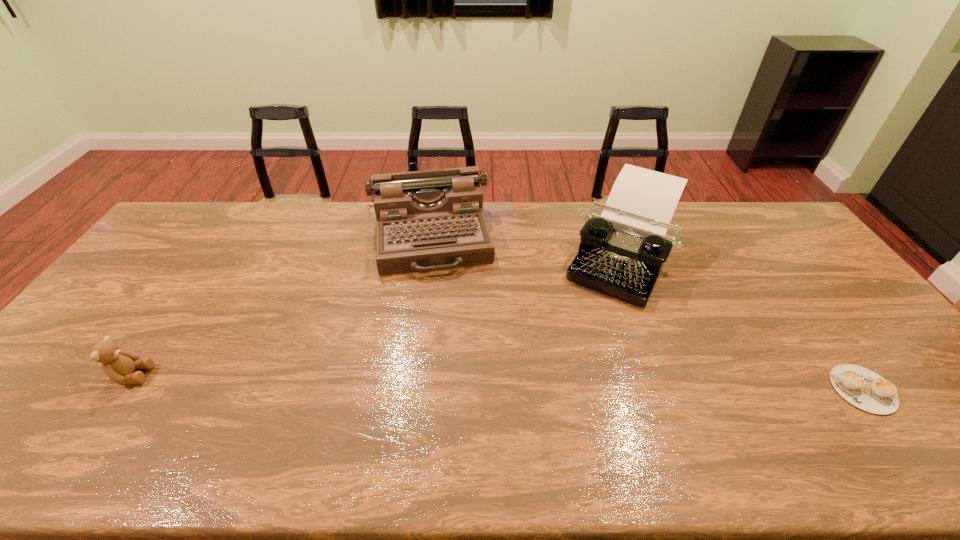
Locate an element on the screen. The height and width of the screenshot is (540, 960). vacant space situated 0.080m on the keys of the right typewriter is located at coordinates (594, 318).

Where is `free space located 0.300m on the keyboard of the second object from left to right`? Image resolution: width=960 pixels, height=540 pixels. free space located 0.300m on the keyboard of the second object from left to right is located at coordinates (446, 355).

The image size is (960, 540). I want to click on free space located 0.200m on the keyboard of the second object from left to right, so click(x=443, y=326).

Find the location of a particular element. This screenshot has width=960, height=540. free region located 0.230m on the keyboard of the second object from left to right is located at coordinates (444, 335).

Identify the location of object that is at the near edge. Image resolution: width=960 pixels, height=540 pixels. (863, 388).

The height and width of the screenshot is (540, 960). What are the coordinates of `object that is at the right edge` in the screenshot? It's located at (863, 388).

Identify the location of object that is at the near right corner. (863, 388).

Find the location of a particular element. Image resolution: width=960 pixels, height=540 pixels. vacant space at the far edge of the desktop is located at coordinates (577, 232).

I want to click on vacant space at the near edge of the desktop, so click(x=372, y=409).

In the image, there is a desktop. At what (x,y) coordinates should I click in order to perform the action: click on vacant space at the left edge. Please return your answer as a coordinate pair (x, y). Looking at the image, I should click on (191, 246).